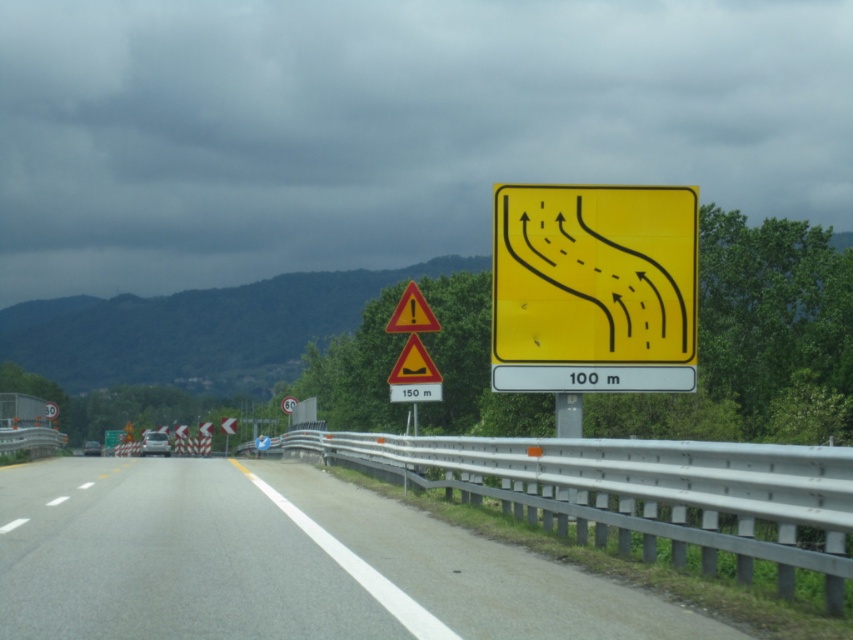
Question: Does gray asphalt road at center appear on the right side of yellow plastic road sign at upper right?

Choices:
 (A) yes
 (B) no

Answer: (B)

Question: Which of the following is the closest to the observer?

Choices:
 (A) (x=207, y=586)
 (B) (x=674, y=371)

Answer: (A)

Question: Which point is closer to the camera?

Choices:
 (A) gray asphalt road at center
 (B) yellow plastic road sign at upper right

Answer: (A)

Question: Which point appears closest to the camera in this image?

Choices:
 (A) pos(199,531)
 (B) pos(556,250)

Answer: (A)

Question: Considering the relative positions of gray asphalt road at center and yellow plastic road sign at upper right in the image provided, where is gray asphalt road at center located with respect to yellow plastic road sign at upper right?

Choices:
 (A) right
 (B) left

Answer: (B)

Question: Does gray asphalt road at center have a smaller size compared to yellow plastic road sign at upper right?

Choices:
 (A) no
 (B) yes

Answer: (A)